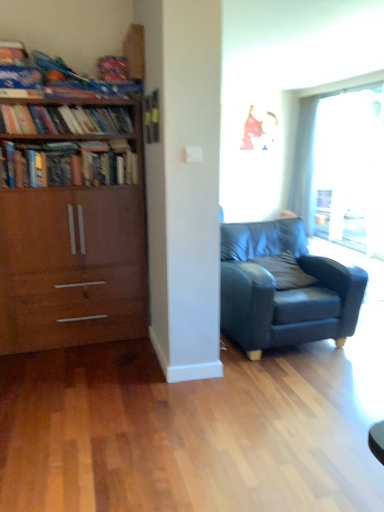
Identify the location of free space in front of wooden bookcase at left. (72, 378).